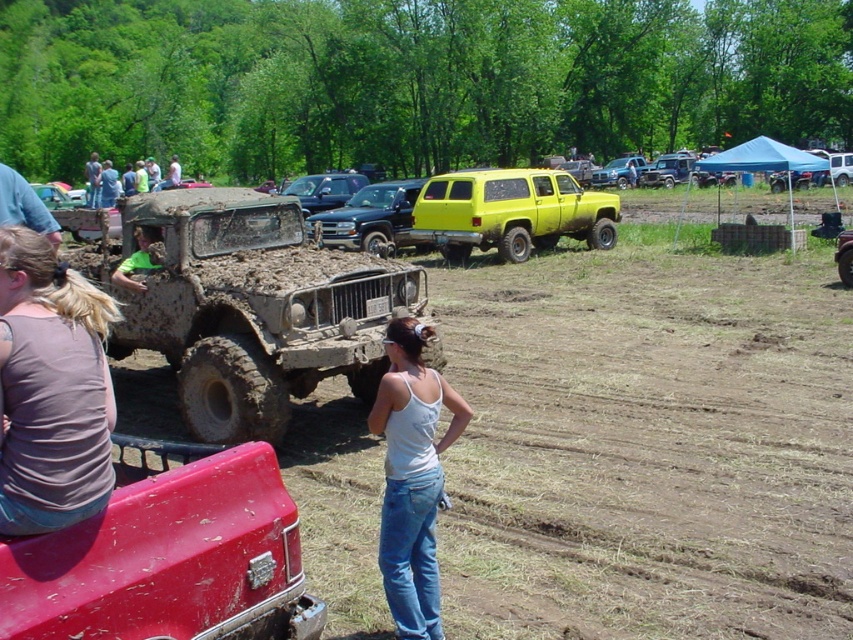
Question: Which object is the closest to the muddy rubber truck at left?

Choices:
 (A) shiny black truck at center
 (B) white cotton tank top at center
 (C) shiny blue truck at center
 (D) matte pink tank top at lower left

Answer: (C)

Question: Observing the image, what is the correct spatial positioning of matte pink tank top at lower left in reference to shiny black truck at center?

Choices:
 (A) right
 (B) left

Answer: (A)

Question: Estimate the real-world distances between objects in this image. Which object is closer to the white cotton tank top at center?

Choices:
 (A) muddy rubber truck at left
 (B) matte pink tank top at lower left

Answer: (B)

Question: Is matte pink tank top at lower left further to the viewer compared to shiny blue truck at center?

Choices:
 (A) yes
 (B) no

Answer: (B)

Question: Does matte pink tank top at lower left appear on the right side of yellow matte suv at center?

Choices:
 (A) no
 (B) yes

Answer: (A)

Question: Which point is farther from the camera taking this photo?

Choices:
 (A) (422, 588)
 (B) (339, 216)

Answer: (B)